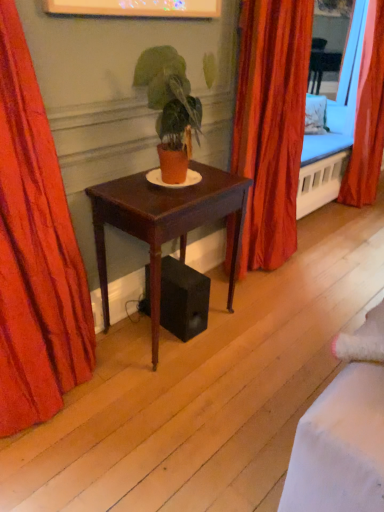
Where is `free space in front of matte orange pot at center`? This screenshot has width=384, height=512. free space in front of matte orange pot at center is located at coordinates (158, 201).